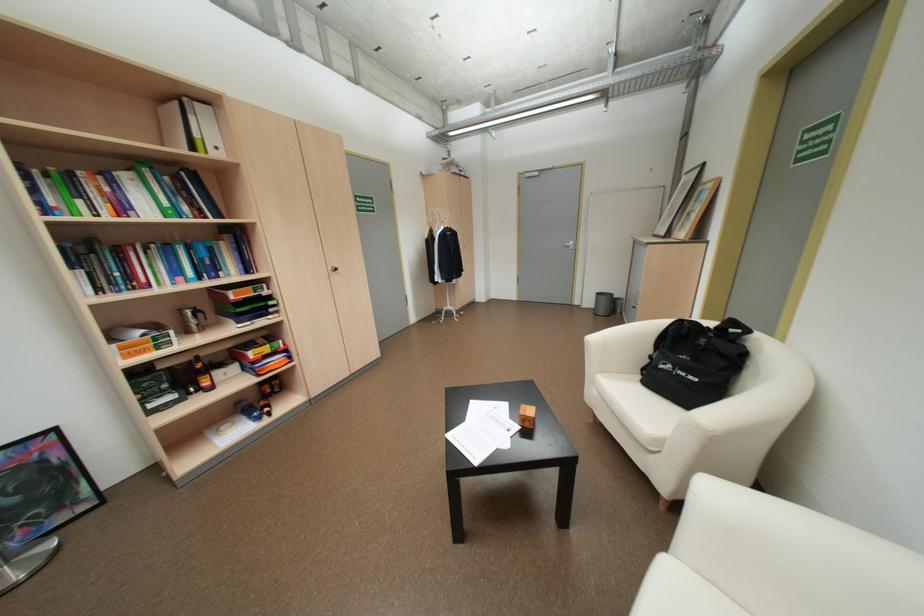
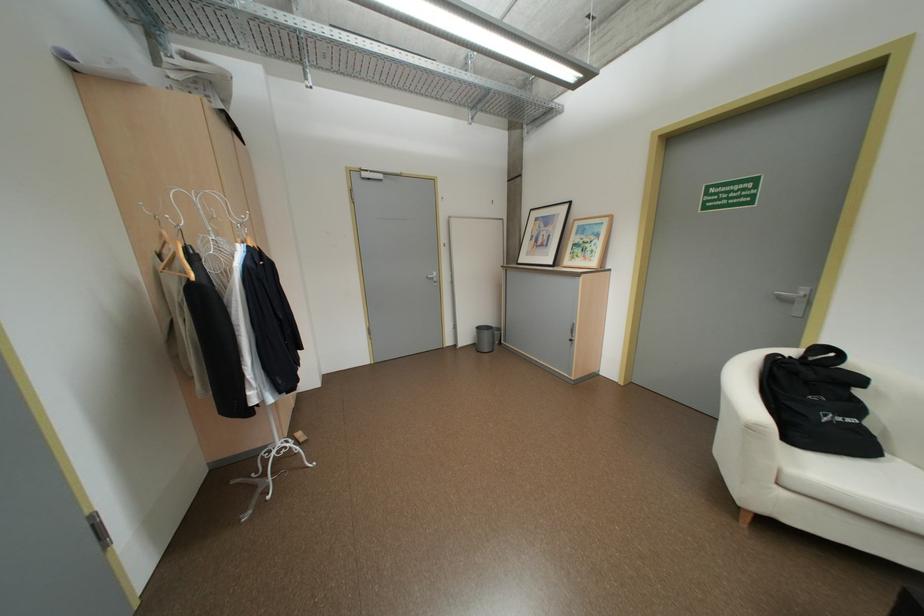
In the second image, find the point that corresponds to point (444, 229) in the first image.

(217, 252)